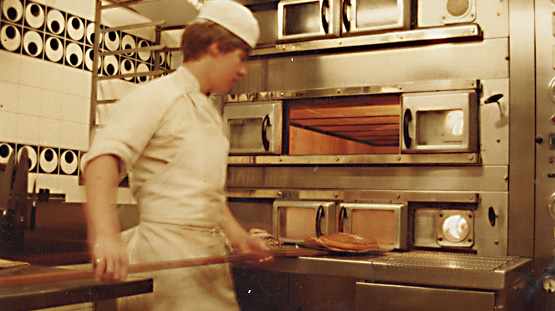
In order to click on counter in this screenshot , I will do `click(90, 286)`.